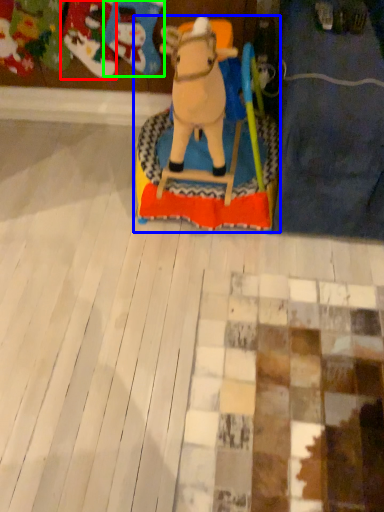
Question: Based on their relative distances, which object is nearer to toy (highlighted by a red box)? Choose from toy (highlighted by a blue box) and toy (highlighted by a green box).

Choices:
 (A) toy
 (B) toy

Answer: (B)